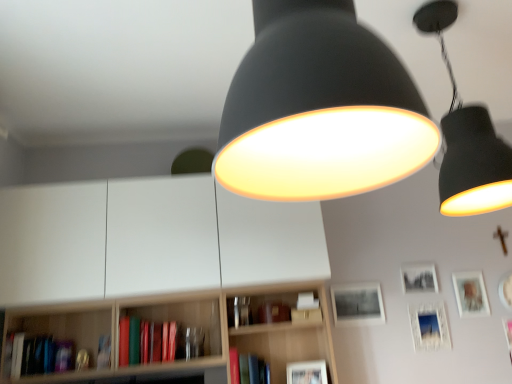
Question: Is matte black lampshade at upper center, which is the 1th lamp from front to back, aimed at matte white picture frame at lower right, which appears as the second picture frame when viewed from the right?

Choices:
 (A) yes
 (B) no

Answer: (B)

Question: Does matte black lampshade at upper center, placed as the 1th lamp when sorted from left to right, have a larger size compared to matte white picture frame at lower right, which appears as the second picture frame when viewed from the right?

Choices:
 (A) no
 (B) yes

Answer: (B)

Question: From a real-world perspective, is matte black lampshade at upper center, marked as the second lamp in a back-to-front arrangement, positioned under matte white picture frame at lower right, which appears as the second picture frame when viewed from the right, based on gravity?

Choices:
 (A) yes
 (B) no

Answer: (B)

Question: From the image's perspective, is matte black lampshade at upper center, which is the 1th lamp from front to back, beneath matte white picture frame at lower right, the 4th picture frame viewed from the left?

Choices:
 (A) no
 (B) yes

Answer: (A)

Question: Is matte black lampshade at upper center, which is the 1th lamp from front to back, turned away from matte white picture frame at lower right, which appears as the second picture frame when viewed from the right?

Choices:
 (A) yes
 (B) no

Answer: (B)

Question: From a real-world perspective, relative to matte white picture frame at lower right, which appears as the second picture frame when viewed from the right, is matte brown book at center, placed as the first book when sorted from right to left, vertically above or below?

Choices:
 (A) below
 (B) above

Answer: (B)

Question: In terms of width, does matte brown book at center, placed as the first book when sorted from right to left, look wider or thinner when compared to matte white picture frame at lower right, which appears as the second picture frame when viewed from the right?

Choices:
 (A) thin
 (B) wide

Answer: (B)

Question: Does point (269, 322) appear closer or farther from the camera than point (420, 339)?

Choices:
 (A) closer
 (B) farther

Answer: (A)

Question: From their relative heights in the image, would you say matte brown book at center, placed as the first book when sorted from right to left, is taller or shorter than matte white picture frame at lower right, the 4th picture frame viewed from the left?

Choices:
 (A) short
 (B) tall

Answer: (A)

Question: Would you say black matte picture frame at upper right, the 3th picture frame in the left-to-right sequence, is to the left or to the right of matte white picture frame at lower center, the fifth picture frame positioned from the right, in the picture?

Choices:
 (A) left
 (B) right

Answer: (B)

Question: From the image's perspective, is black matte picture frame at upper right, the 3th picture frame in the left-to-right sequence, located above or below matte white picture frame at lower center, the fifth picture frame positioned from the right?

Choices:
 (A) above
 (B) below

Answer: (A)

Question: From a real-world perspective, is black matte picture frame at upper right, the 3th picture frame in the left-to-right sequence, positioned above or below matte white picture frame at lower center, the fifth picture frame positioned from the right?

Choices:
 (A) below
 (B) above

Answer: (B)

Question: Is black matte picture frame at upper right, the 3th picture frame in the left-to-right sequence, spatially inside matte white picture frame at lower center, the first picture frame in the left-to-right sequence, or outside of it?

Choices:
 (A) outside
 (B) inside

Answer: (A)

Question: Relative to matte black lampshade at upper center, marked as the second lamp in a back-to-front arrangement, is hardcover book at lower left, the second book from the left, in front or behind?

Choices:
 (A) behind
 (B) front

Answer: (A)

Question: Is hardcover book at lower left, the second book from the left, taller or shorter than matte black lampshade at upper center, which is the 1th lamp from front to back?

Choices:
 (A) short
 (B) tall

Answer: (A)